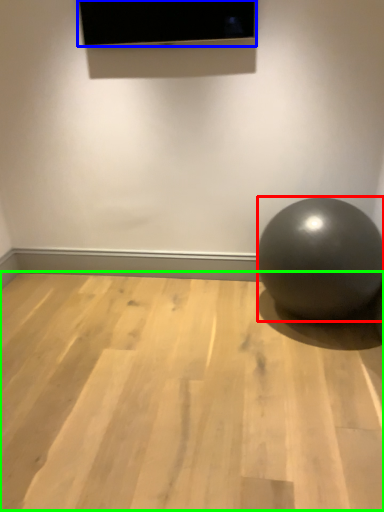
Question: Based on their relative distances, which object is farther from ball (highlighted by a red box)? Choose from projection screen (highlighted by a blue box) and surface (highlighted by a green box).

Choices:
 (A) projection screen
 (B) surface

Answer: (A)